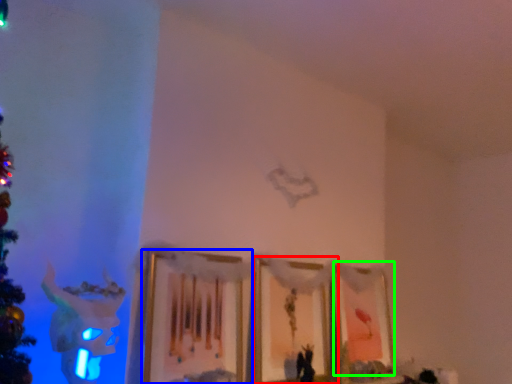
Question: Estimate the real-world distances between objects in this image. Which object is closer to picture frame (highlighted by a red box), picture frame (highlighted by a blue box) or picture frame (highlighted by a green box)?

Choices:
 (A) picture frame
 (B) picture frame

Answer: (B)